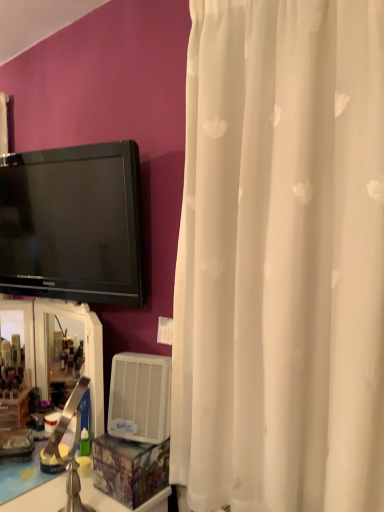
Identify the location of brushed metal faucet at lower left. (71, 448).

The image size is (384, 512). What are the coordinates of `translucent plastic mirror at lower left` in the screenshot? It's located at (84, 351).

I want to click on white plastic air conditioner at lower center, so click(x=140, y=397).

You are a GUI agent. You are given a task and a screenshot of the screen. Output one action in this format:
    pyautogui.click(x=<x>, y=<y>)
    Task: Click on the white glossy counter top at lower left
    
    Given the screenshot: What is the action you would take?
    pyautogui.click(x=31, y=486)

What is the approximate width of white sheer curtain at right?

It is 7.37 inches.

Where is `brushed metal faucet at lower left`? brushed metal faucet at lower left is located at coordinates (71, 448).

Looking at this image, is white plastic air conditioner at lower center at the left side of brushed metal faucet at lower left?

No, white plastic air conditioner at lower center is not to the left of brushed metal faucet at lower left.

In the scene shown: Is white plastic air conditioner at lower center far from brushed metal faucet at lower left?

white plastic air conditioner at lower center is near brushed metal faucet at lower left, not far away.

How many degrees apart are the facing directions of white plastic air conditioner at lower center and brushed metal faucet at lower left?

There is a 67-degree angle between the facing directions of white plastic air conditioner at lower center and brushed metal faucet at lower left.

Is white plastic air conditioner at lower center looking in the opposite direction of brushed metal faucet at lower left?

No, white plastic air conditioner at lower center is not facing away from brushed metal faucet at lower left.

Who is taller, black glossy tv at upper left or white plastic air conditioner at lower center?

Standing taller between the two is black glossy tv at upper left.

In order to click on television above the white plastic air conditioner at lower center (from the image's perspective) in this screenshot , I will do coord(72,223).

Is the position of black glossy tv at upper left more distant than that of white plastic air conditioner at lower center?

Yes, black glossy tv at upper left is further from the viewer.

Who is smaller, black glossy tv at upper left or white plastic air conditioner at lower center?

white plastic air conditioner at lower center.

Is white glossy counter top at lower left bigger than translucent plastic mirror at lower left?

Yes, white glossy counter top at lower left is bigger than translucent plastic mirror at lower left.

Between white glossy counter top at lower left and translucent plastic mirror at lower left, which one appears on the right side from the viewer's perspective?

From the viewer's perspective, translucent plastic mirror at lower left appears more on the right side.

Is point (44, 475) closer or farther from the camera than point (47, 347)?

Point (44, 475) is closer to the camera than point (47, 347).

From a real-world perspective, does brushed metal faucet at lower left stand above black glossy tv at upper left?

Incorrect, from a real-world perspective, brushed metal faucet at lower left is lower than black glossy tv at upper left.

Between brushed metal faucet at lower left and black glossy tv at upper left, which one appears on the right side from the viewer's perspective?

From the viewer's perspective, brushed metal faucet at lower left appears more on the right side.

In the image, is brushed metal faucet at lower left positioned in front of or behind black glossy tv at upper left?

In the image, brushed metal faucet at lower left appears in front of black glossy tv at upper left.

Can you confirm if brushed metal faucet at lower left is smaller than black glossy tv at upper left?

Yes, brushed metal faucet at lower left is smaller than black glossy tv at upper left.

Is black glossy tv at upper left positioned with its back to brushed metal faucet at lower left?

black glossy tv at upper left is not turned away from brushed metal faucet at lower left.

Which object is more forward, black glossy tv at upper left or brushed metal faucet at lower left?

brushed metal faucet at lower left is closer to the camera.

This screenshot has width=384, height=512. What are the coordinates of `television behind the brushed metal faucet at lower left` in the screenshot? It's located at (72, 223).

From the image's perspective, is black glossy tv at upper left below brushed metal faucet at lower left?

Incorrect, from the image's perspective, black glossy tv at upper left is higher than brushed metal faucet at lower left.

Would you say white sheer curtain at right is inside or outside white plastic air conditioner at lower center?

white sheer curtain at right is spatially situated outside white plastic air conditioner at lower center.

You are a GUI agent. You are given a task and a screenshot of the screen. Output one action in this format:
    pyautogui.click(x=<x>, y=<y>)
    Task: Click on the curtain to the right of white plastic air conditioner at lower center
    
    Given the screenshot: What is the action you would take?
    pyautogui.click(x=281, y=259)

Which point is more forward, (288, 33) or (135, 439)?

Positioned in front is point (288, 33).

From a real-world perspective, which object rests below the other?

white plastic air conditioner at lower center is physically lower.

Can you confirm if white plastic air conditioner at lower center is thinner than white sheer curtain at right?

Correct, the width of white plastic air conditioner at lower center is less than that of white sheer curtain at right.

Based on the photo, from a real-world perspective, is white plastic air conditioner at lower center on white sheer curtain at right?

No, from a real-world perspective, white plastic air conditioner at lower center is not above white sheer curtain at right.

How many degrees apart are the facing directions of white plastic air conditioner at lower center and white sheer curtain at right?

The angle between the facing direction of white plastic air conditioner at lower center and the facing direction of white sheer curtain at right is 21.4 degrees.

Is point (129, 355) closer or farther from the camera than point (370, 328)?

Point (129, 355) appears to be farther away from the viewer than point (370, 328).

Find the location of a particular element. The image size is (384, 512). faucet below the white plastic air conditioner at lower center (from a real-world perspective) is located at coordinates (71, 448).

At what (x,y) coordinates should I click in order to perform the action: click on air conditioner that is in front of the black glossy tv at upper left. Please return your answer as a coordinate pair (x, y). The width and height of the screenshot is (384, 512). Looking at the image, I should click on (140, 397).

From the image, which object appears to be nearer to white glossy counter top at lower left, white plastic air conditioner at lower center or translucent plastic mirror at lower left?

translucent plastic mirror at lower left is positioned closer to the anchor white glossy counter top at lower left.

When comparing their distances from white sheer curtain at right, does black glossy tv at upper left or translucent plastic mirror at lower left seem further?

Based on the image, translucent plastic mirror at lower left appears to be further to white sheer curtain at right.

Estimate the real-world distances between objects in this image. Which object is closer to white glossy counter top at lower left, white sheer curtain at right or brushed metal faucet at lower left?

brushed metal faucet at lower left is closer to white glossy counter top at lower left.

When comparing their distances from white sheer curtain at right, does white plastic air conditioner at lower center or brushed metal faucet at lower left seem closer?

white plastic air conditioner at lower center.

Based on their spatial positions, is white sheer curtain at right or white plastic air conditioner at lower center further from white glossy counter top at lower left?

Based on the image, white sheer curtain at right appears to be further to white glossy counter top at lower left.

Which object lies nearer to the anchor point brushed metal faucet at lower left, white sheer curtain at right or translucent plastic mirror at lower left?

translucent plastic mirror at lower left lies closer to brushed metal faucet at lower left than the other object.

Which object lies nearer to the anchor point white plastic air conditioner at lower center, white sheer curtain at right or white glossy counter top at lower left?

white glossy counter top at lower left lies closer to white plastic air conditioner at lower center than the other object.

Considering their positions, is black glossy tv at upper left positioned further to translucent plastic mirror at lower left than white glossy counter top at lower left?

black glossy tv at upper left lies further to translucent plastic mirror at lower left than the other object.

Find the location of a particular element. Image resolution: width=384 pixels, height=512 pixels. air conditioner located between translucent plastic mirror at lower left and white sheer curtain at right in the left-right direction is located at coordinates (140, 397).

This screenshot has height=512, width=384. Identify the location of air conditioner between black glossy tv at upper left and white glossy counter top at lower left vertically. (140, 397).

Locate an element on the screen. The width and height of the screenshot is (384, 512). faucet located between black glossy tv at upper left and white sheer curtain at right in the left-right direction is located at coordinates (71, 448).

Where is `air conditioner between white sheer curtain at right and white glossy counter top at lower left from top to bottom`? The height and width of the screenshot is (512, 384). air conditioner between white sheer curtain at right and white glossy counter top at lower left from top to bottom is located at coordinates (140, 397).